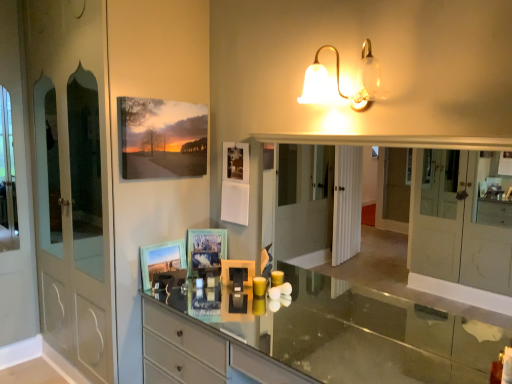
Find the location of a particular element. The image size is (512, 384). matte canvas painting at upper left, positioned as the third picture frame in bottom-to-top order is located at coordinates (161, 138).

How much space does matte canvas painting at upper left, positioned as the third picture frame in bottom-to-top order, occupy horizontally?

matte canvas painting at upper left, positioned as the third picture frame in bottom-to-top order, is 2.00 inches in width.

Describe the element at coordinates (462, 218) in the screenshot. The height and width of the screenshot is (384, 512). I see `clear glass mirror at center` at that location.

Image resolution: width=512 pixels, height=384 pixels. In order to click on translucent glass sconce at upper center in this screenshot , I will do `click(339, 81)`.

Considering the relative sizes of matte canvas painting at upper left, marked as the first picture frame in a top-to-bottom arrangement, and clear glass mirror at center in the image provided, is matte canvas painting at upper left, marked as the first picture frame in a top-to-bottom arrangement, shorter than clear glass mirror at center?

Yes.

Who is smaller, matte canvas painting at upper left, marked as the first picture frame in a top-to-bottom arrangement, or clear glass mirror at center?

Smaller between the two is matte canvas painting at upper left, marked as the first picture frame in a top-to-bottom arrangement.

Which object is thinner, matte canvas painting at upper left, positioned as the third picture frame in bottom-to-top order, or clear glass mirror at center?

matte canvas painting at upper left, positioned as the third picture frame in bottom-to-top order.

In order to click on lamp located in front of the matte canvas painting at upper left, positioned as the third picture frame in bottom-to-top order in this screenshot , I will do `click(339, 81)`.

What's the angular difference between translucent glass sconce at upper center and matte canvas painting at upper left, positioned as the third picture frame in bottom-to-top order,'s facing directions?

88.8 degrees.

Looking at this image, is translucent glass sconce at upper center located outside matte canvas painting at upper left, marked as the first picture frame in a top-to-bottom arrangement?

Absolutely, translucent glass sconce at upper center is external to matte canvas painting at upper left, marked as the first picture frame in a top-to-bottom arrangement.

Which is less distant, (301, 99) or (185, 114)?

The point (301, 99) is more forward.

Is translucent glass sconce at upper center situated inside clear glass mirror at center or outside?

translucent glass sconce at upper center cannot be found inside clear glass mirror at center.

Is the depth of translucent glass sconce at upper center less than that of clear glass mirror at center?

No, translucent glass sconce at upper center is further to the viewer.

Considering the sizes of objects translucent glass sconce at upper center and clear glass mirror at center in the image provided, who is bigger, translucent glass sconce at upper center or clear glass mirror at center?

clear glass mirror at center is bigger.

How far apart are translucent glass sconce at upper center and clear glass mirror at center?

The distance of translucent glass sconce at upper center from clear glass mirror at center is 2.74 meters.

Which object is more forward, translucent glass sconce at upper center or matte glass picture frame at center, the 3th picture frame in the top-to-bottom sequence?

Positioned in front is translucent glass sconce at upper center.

Can you tell me how much translucent glass sconce at upper center and matte glass picture frame at center, arranged as the 1th picture frame when ordered from the bottom, differ in facing direction?

90 degrees separate the facing orientations of translucent glass sconce at upper center and matte glass picture frame at center, arranged as the 1th picture frame when ordered from the bottom.

Is translucent glass sconce at upper center at the left side of matte glass picture frame at center, the 3th picture frame in the top-to-bottom sequence?

In fact, translucent glass sconce at upper center is to the right of matte glass picture frame at center, the 3th picture frame in the top-to-bottom sequence.

Based on the photo, measure the distance from translucent glass sconce at upper center to matte glass picture frame at center, the 3th picture frame in the top-to-bottom sequence.

translucent glass sconce at upper center is 1.25 meters away from matte glass picture frame at center, the 3th picture frame in the top-to-bottom sequence.

From a real-world perspective, is matte blue picture frame at center, which appears as the second picture frame when viewed from the top, positioned over matte canvas painting at upper left, positioned as the third picture frame in bottom-to-top order, based on gravity?

No, from a real-world perspective, matte blue picture frame at center, which appears as the second picture frame when viewed from the top, is not above matte canvas painting at upper left, positioned as the third picture frame in bottom-to-top order.

Is matte blue picture frame at center, which appears as the 2th picture frame when ordered from the bottom, turned away from matte canvas painting at upper left, marked as the first picture frame in a top-to-bottom arrangement?

No, matte blue picture frame at center, which appears as the 2th picture frame when ordered from the bottom,'s orientation is not away from matte canvas painting at upper left, marked as the first picture frame in a top-to-bottom arrangement.

Is matte blue picture frame at center, which appears as the second picture frame when viewed from the top, far away from matte canvas painting at upper left, positioned as the third picture frame in bottom-to-top order?

matte blue picture frame at center, which appears as the second picture frame when viewed from the top, is actually quite close to matte canvas painting at upper left, positioned as the third picture frame in bottom-to-top order.

Considering the relative sizes of matte blue picture frame at center, which appears as the second picture frame when viewed from the top, and matte canvas painting at upper left, positioned as the third picture frame in bottom-to-top order, in the image provided, is matte blue picture frame at center, which appears as the second picture frame when viewed from the top, thinner than matte canvas painting at upper left, positioned as the third picture frame in bottom-to-top order,?

Yes.

From the matte blue picture frame at center, which appears as the 2th picture frame when ordered from the bottom, count the 2nd picture frame to the left and point to it. Please provide its 2D coordinates.

[(162, 260)]

From the image's perspective, which is below, matte glass picture frame at center, arranged as the 1th picture frame when ordered from the bottom, or matte blue picture frame at center, which appears as the second picture frame when viewed from the top?

matte glass picture frame at center, arranged as the 1th picture frame when ordered from the bottom, from the image's perspective.

From the picture: From a real-world perspective, between matte glass picture frame at center, the 3th picture frame in the top-to-bottom sequence, and matte blue picture frame at center, which appears as the second picture frame when viewed from the top, who is vertically higher?

matte blue picture frame at center, which appears as the second picture frame when viewed from the top.

Is matte glass picture frame at center, the 3th picture frame in the top-to-bottom sequence, at the left side of matte blue picture frame at center, which appears as the second picture frame when viewed from the top?

Yes.

Is matte glass picture frame at center, arranged as the 1th picture frame when ordered from the bottom, far from smooth glass countertop at center?

Absolutely, matte glass picture frame at center, arranged as the 1th picture frame when ordered from the bottom, is distant from smooth glass countertop at center.

Which object is closer to the camera taking this photo, matte glass picture frame at center, arranged as the 1th picture frame when ordered from the bottom, or smooth glass countertop at center?

Positioned in front is smooth glass countertop at center.

Does matte glass picture frame at center, arranged as the 1th picture frame when ordered from the bottom, turn towards smooth glass countertop at center?

No, matte glass picture frame at center, arranged as the 1th picture frame when ordered from the bottom, does not turn towards smooth glass countertop at center.

I want to click on picture frame positioned vertically above the clear glass mirror at center (from a real-world perspective), so click(161, 138).

Where is `lamp above the matte canvas painting at upper left, positioned as the third picture frame in bottom-to-top order (from the image's perspective)`? Image resolution: width=512 pixels, height=384 pixels. lamp above the matte canvas painting at upper left, positioned as the third picture frame in bottom-to-top order (from the image's perspective) is located at coordinates (339, 81).

Which object lies further to the anchor point smooth glass countertop at center, matte canvas painting at upper left, marked as the first picture frame in a top-to-bottom arrangement, or clear glass mirror at center?

matte canvas painting at upper left, marked as the first picture frame in a top-to-bottom arrangement.

Based on their spatial positions, is matte canvas painting at upper left, positioned as the third picture frame in bottom-to-top order, or translucent glass sconce at upper center further from matte glass picture frame at center, arranged as the 1th picture frame when ordered from the bottom?

translucent glass sconce at upper center.

Estimate the real-world distances between objects in this image. Which object is further from clear glass mirror at center, matte glass picture frame at center, arranged as the 1th picture frame when ordered from the bottom, or matte canvas painting at upper left, positioned as the third picture frame in bottom-to-top order?

matte glass picture frame at center, arranged as the 1th picture frame when ordered from the bottom, is positioned further to the anchor clear glass mirror at center.

From the image, which object appears to be farther from matte glass picture frame at center, the 3th picture frame in the top-to-bottom sequence, matte blue picture frame at center, which appears as the second picture frame when viewed from the top, or matte canvas painting at upper left, positioned as the third picture frame in bottom-to-top order?

matte canvas painting at upper left, positioned as the third picture frame in bottom-to-top order, lies further to matte glass picture frame at center, the 3th picture frame in the top-to-bottom sequence, than the other object.

When comparing their distances from smooth glass countertop at center, does matte glass picture frame at center, the 3th picture frame in the top-to-bottom sequence, or translucent glass sconce at upper center seem further?

Based on the image, translucent glass sconce at upper center appears to be further to smooth glass countertop at center.

Looking at this image, when comparing their distances from matte glass picture frame at center, the 3th picture frame in the top-to-bottom sequence, does translucent glass sconce at upper center or smooth glass countertop at center seem closer?

translucent glass sconce at upper center.

Considering their positions, is matte glass picture frame at center, the 3th picture frame in the top-to-bottom sequence, positioned further to translucent glass sconce at upper center than matte blue picture frame at center, which appears as the second picture frame when viewed from the top?

matte glass picture frame at center, the 3th picture frame in the top-to-bottom sequence, lies further to translucent glass sconce at upper center than the other object.

Considering their positions, is matte blue picture frame at center, which appears as the second picture frame when viewed from the top, positioned closer to matte canvas painting at upper left, positioned as the third picture frame in bottom-to-top order, than matte glass picture frame at center, the 3th picture frame in the top-to-bottom sequence?

matte glass picture frame at center, the 3th picture frame in the top-to-bottom sequence, is positioned closer to the anchor matte canvas painting at upper left, positioned as the third picture frame in bottom-to-top order.

I want to click on lamp situated between matte canvas painting at upper left, positioned as the third picture frame in bottom-to-top order, and clear glass mirror at center from left to right, so click(339, 81).

Where is `mirror positioned between smooth glass countertop at center and matte glass picture frame at center, arranged as the 1th picture frame when ordered from the bottom, from near to far`? mirror positioned between smooth glass countertop at center and matte glass picture frame at center, arranged as the 1th picture frame when ordered from the bottom, from near to far is located at coordinates (462, 218).

Find the location of a particular element. picture frame between matte canvas painting at upper left, marked as the first picture frame in a top-to-bottom arrangement, and matte glass picture frame at center, arranged as the 1th picture frame when ordered from the bottom, vertically is located at coordinates (205, 248).

Locate an element on the screen. mirror between translucent glass sconce at upper center and smooth glass countertop at center in the vertical direction is located at coordinates (462, 218).